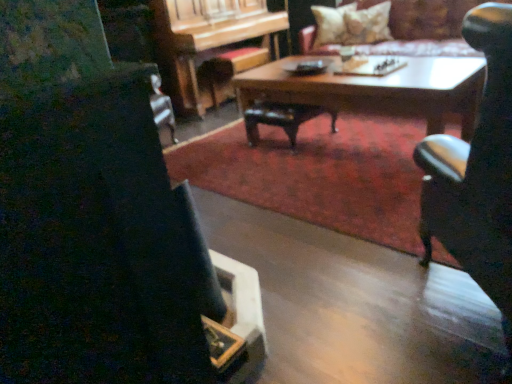
Question: Would you say wooden piano at center contains wooden coffee table at center?

Choices:
 (A) yes
 (B) no

Answer: (B)

Question: Does wooden piano at center have a lesser width compared to wooden coffee table at center?

Choices:
 (A) yes
 (B) no

Answer: (A)

Question: Is wooden piano at center in contact with wooden coffee table at center?

Choices:
 (A) yes
 (B) no

Answer: (B)

Question: Considering the relative positions of wooden piano at center and wooden coffee table at center in the image provided, is wooden piano at center to the right of wooden coffee table at center from the viewer's perspective?

Choices:
 (A) no
 (B) yes

Answer: (A)

Question: Can we say wooden piano at center lies outside wooden coffee table at center?

Choices:
 (A) no
 (B) yes

Answer: (B)

Question: Relative to fluffy beige pillow at upper right, placed as the 2th pillow when sorted from left to right, is black leather chair at right in front or behind?

Choices:
 (A) front
 (B) behind

Answer: (A)

Question: In terms of height, does black leather chair at right look taller or shorter compared to fluffy beige pillow at upper right, placed as the first pillow when sorted from right to left?

Choices:
 (A) short
 (B) tall

Answer: (B)

Question: Looking at their shapes, would you say black leather chair at right is wider or thinner than fluffy beige pillow at upper right, placed as the 2th pillow when sorted from left to right?

Choices:
 (A) wide
 (B) thin

Answer: (A)

Question: Do you think black leather chair at right is within fluffy beige pillow at upper right, placed as the first pillow when sorted from right to left, or outside of it?

Choices:
 (A) outside
 (B) inside

Answer: (A)

Question: Relative to soft beige pillow at upper center, which is the first pillow from left to right, is black leather chair at right in front or behind?

Choices:
 (A) front
 (B) behind

Answer: (A)

Question: Looking at the image, does black leather chair at right seem bigger or smaller compared to soft beige pillow at upper center, which appears as the 2th pillow when viewed from the right?

Choices:
 (A) small
 (B) big

Answer: (B)

Question: From a real-world perspective, is black leather chair at right physically located above or below soft beige pillow at upper center, which appears as the 2th pillow when viewed from the right?

Choices:
 (A) below
 (B) above

Answer: (A)

Question: From the image's perspective, is black leather chair at right located above or below soft beige pillow at upper center, which is the first pillow from left to right?

Choices:
 (A) above
 (B) below

Answer: (B)

Question: In terms of width, does wooden coffee table at center look wider or thinner when compared to wooden piano at center?

Choices:
 (A) thin
 (B) wide

Answer: (B)

Question: Would you say wooden coffee table at center is inside or outside wooden piano at center?

Choices:
 (A) outside
 (B) inside

Answer: (A)